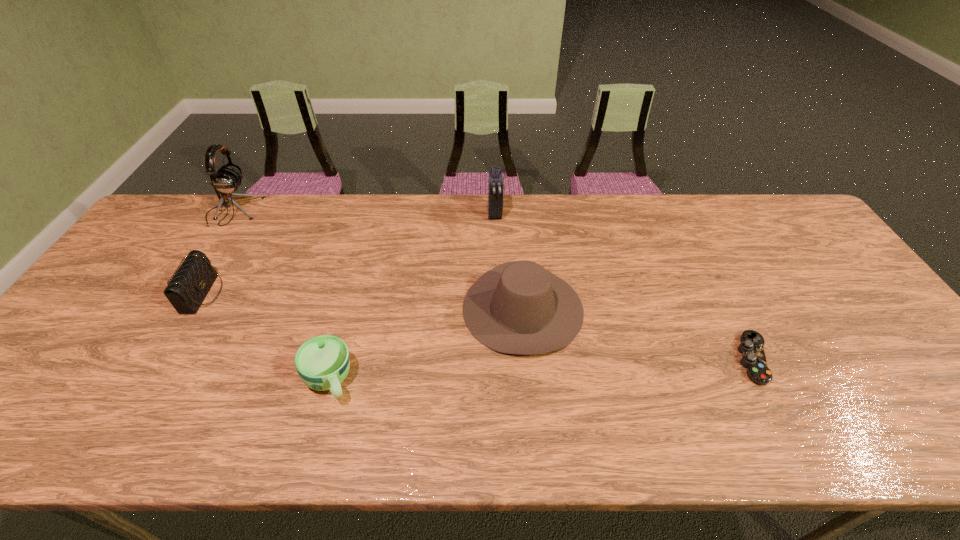
Locate which object ranks second in proximity to the cowboy hat. Please provide its 2D coordinates. Your answer should be formatted as a tuple, i.e. [(x, y)], where the tuple contains the x and y coordinates of a point satisfying the conditions above.

[(322, 362)]

Locate an element on the screen. blank area in the image that satisfies the following two spatial constraints: 1. on the front flap of the nearer clutch bag; 2. on the back side of the cowboy hat is located at coordinates (195, 308).

Identify the location of blank space that satisfies the following two spatial constraints: 1. on the back side of the cowboy hat; 2. on the right side of the fourth object from right to left. The width and height of the screenshot is (960, 540). (348, 308).

Locate an element on the screen. The image size is (960, 540). vacant space that satisfies the following two spatial constraints: 1. with the zip open on the taller clutch bag; 2. on the left side of the cowboy hat is located at coordinates (498, 308).

Locate an element on the screen. free location that satisfies the following two spatial constraints: 1. on the front flap of the rightmost object; 2. on the right side of the left clutch bag is located at coordinates (165, 359).

Identify the location of free space that satisfies the following two spatial constraints: 1. on the front flap of the nearer clutch bag; 2. on the left side of the cowboy hat. The width and height of the screenshot is (960, 540). (195, 308).

Image resolution: width=960 pixels, height=540 pixels. I want to click on vacant region that satisfies the following two spatial constraints: 1. on the back side of the third object from left to right; 2. on the left side of the fourth shortest object, so click(348, 308).

Locate an element on the screen. The height and width of the screenshot is (540, 960). vacant space that satisfies the following two spatial constraints: 1. with the zip open on the cowboy hat; 2. on the right side of the taller clutch bag is located at coordinates (498, 308).